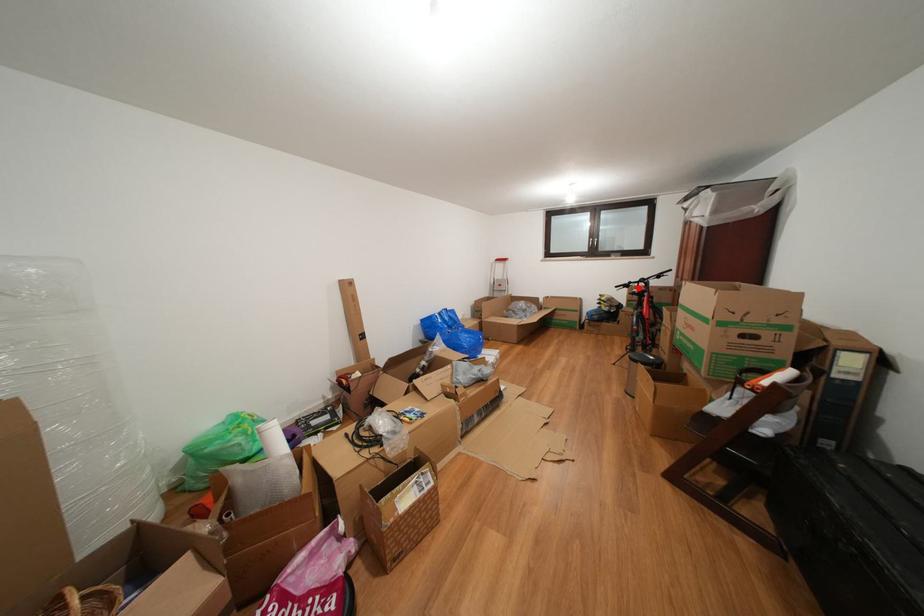
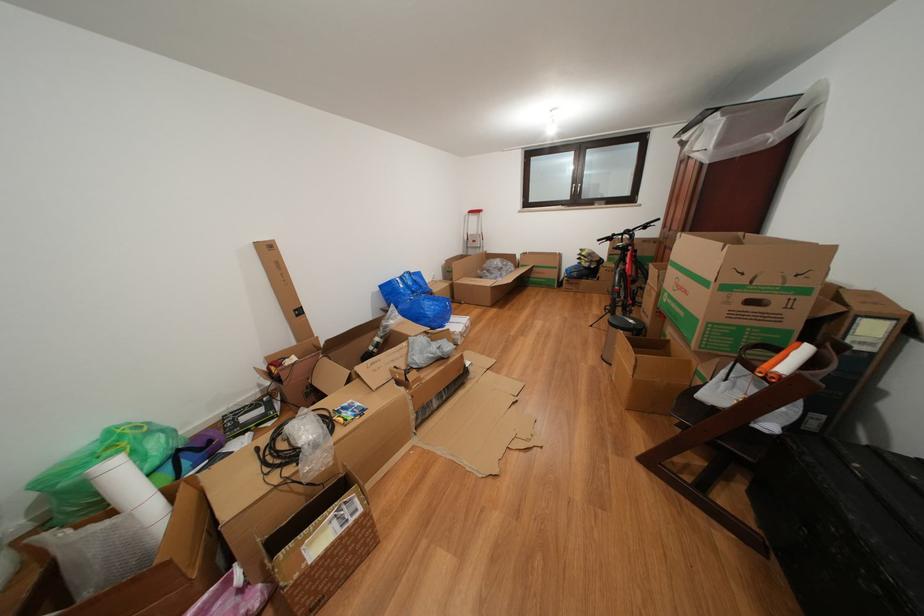
Find the pixel in the second image that matches the highlighted location in the first image.

(622, 240)